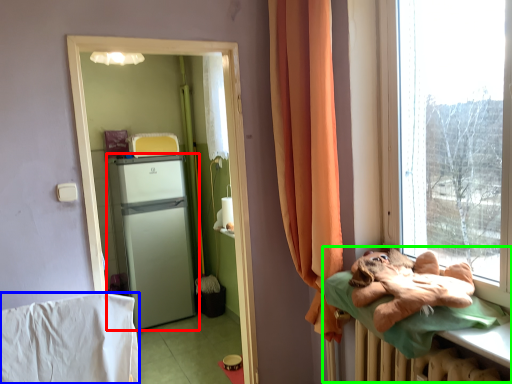
Question: Estimate the real-world distances between objects in this image. Which object is closer to refrigerator (highlighted by a red box), blanket (highlighted by a blue box) or hospital bed (highlighted by a green box)?

Choices:
 (A) blanket
 (B) hospital bed

Answer: (A)